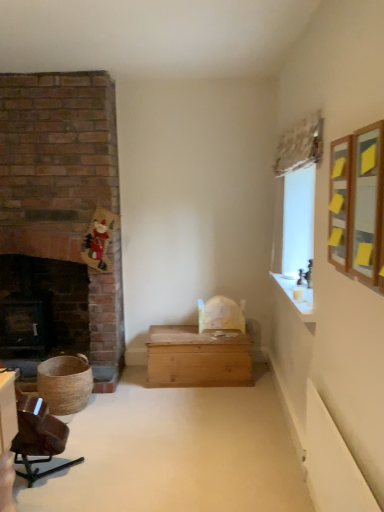
Identify the location of spots to the right of shiny brown leather chair at lower left. (112, 480).